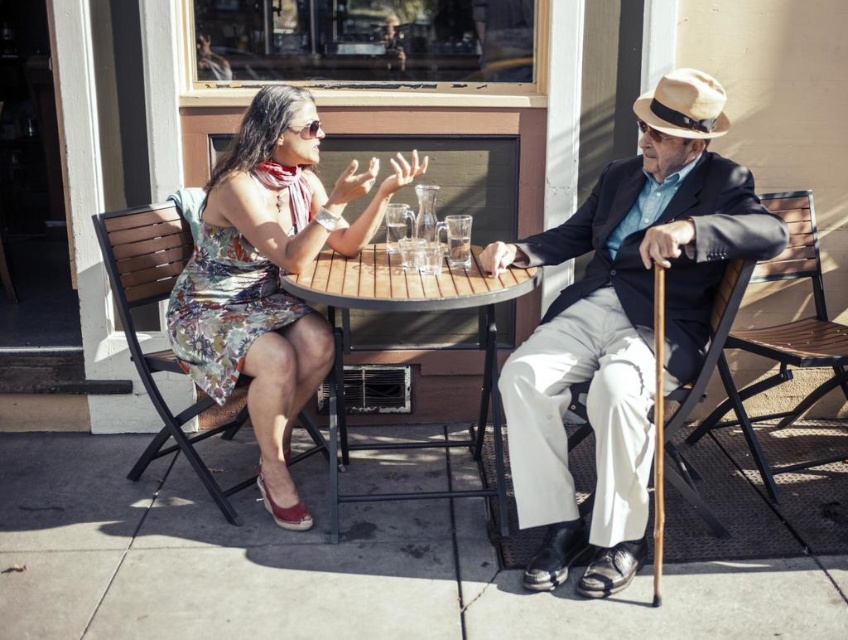
This screenshot has width=848, height=640. What do you see at coordinates (271, 275) in the screenshot?
I see `floral dress at center` at bounding box center [271, 275].

Does floral dress at center have a larger size compared to clear glass mug at center?

Yes.

Is point (236, 202) closer to camera compared to point (462, 248)?

Yes.

The image size is (848, 640). Find the location of `floral dress at center`. floral dress at center is located at coordinates (271, 275).

Does wooden table at center appear on the left side of clear glass mug at center?

Correct, you'll find wooden table at center to the left of clear glass mug at center.

Does wooden table at center lie in front of clear glass mug at center?

Yes, it is.

The width and height of the screenshot is (848, 640). Find the location of `wooden table at center`. wooden table at center is located at coordinates (405, 310).

Does light brown leather suit at right have a greater height compared to clear glass mug at center?

Yes.

The image size is (848, 640). What do you see at coordinates (623, 324) in the screenshot?
I see `light brown leather suit at right` at bounding box center [623, 324].

Is point (660, 225) closer to camera compared to point (450, 248)?

Yes.

At what (x,y) coordinates should I click in order to perform the action: click on light brown leather suit at right. Please return your answer as a coordinate pair (x, y). The image size is (848, 640). Looking at the image, I should click on (623, 324).